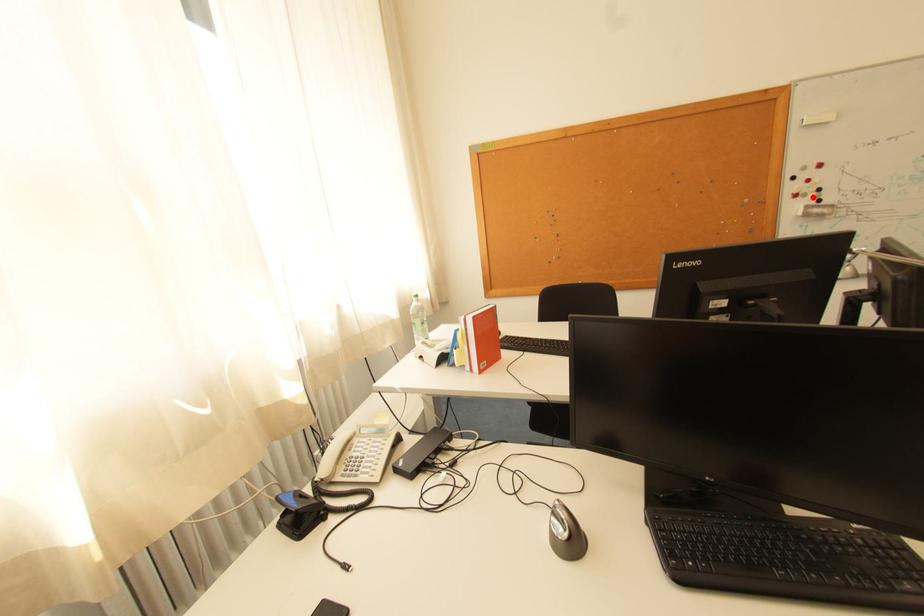
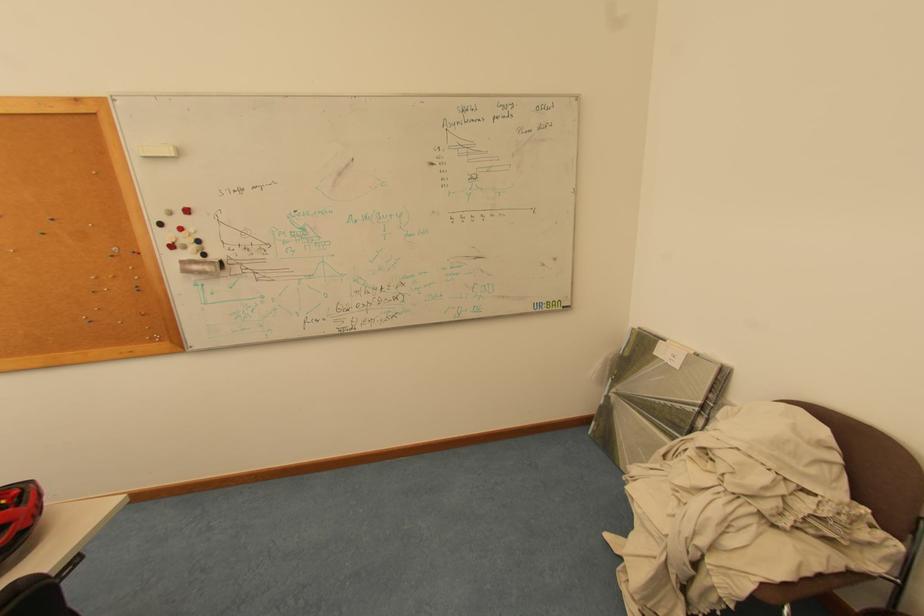
In the second image, find the point that corresponds to the highlighted location in the first image.

(193, 249)